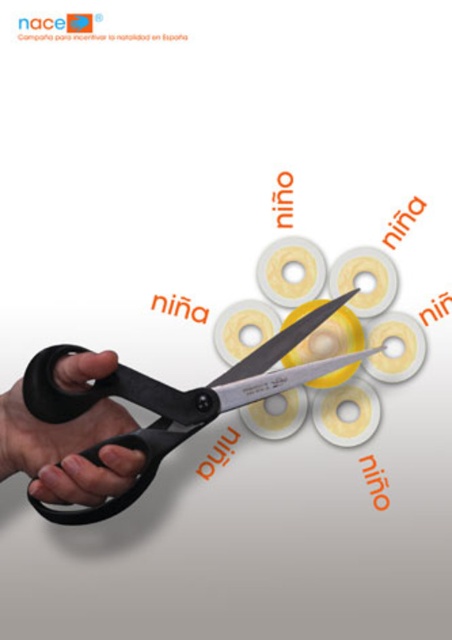
You are an artist trying to place a sticker on the image. You have two points to choose from, point (156, 426) and point (4, 394). If you want to place the sticker where it won t be covered by any other elements, which point should you choose?

Point (156, 426) is behind point (4, 394), so placing the sticker at point (4, 394) would be less likely to be covered by other elements since it is in front.

You are an artist trying to paint the scene. You need to paint the black rubber hand at lower left and the black plastic scissors at center. Which object should you paint first to follow the correct layering?

The black rubber hand at lower left should be painted first because it is behind the black plastic scissors at center, so painting the hand first allows the scissors to be placed over it in the correct layering.